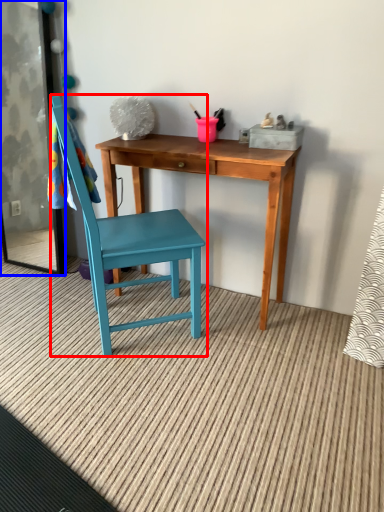
Question: Which point is further to the camera, chair (highlighted by a red box) or screen door (highlighted by a blue box)?

Choices:
 (A) chair
 (B) screen door

Answer: (B)